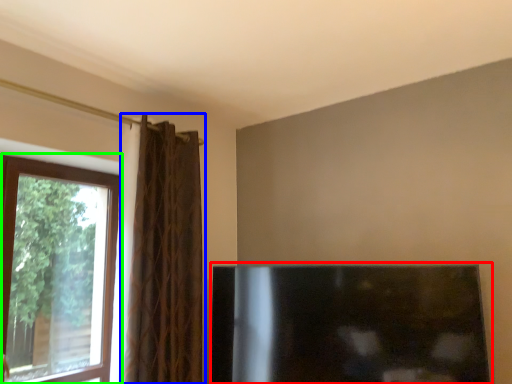
Question: Based on their relative distances, which object is nearer to fireplace (highlighted by a red box)? Choose from curtain (highlighted by a blue box) and window (highlighted by a green box).

Choices:
 (A) curtain
 (B) window

Answer: (A)